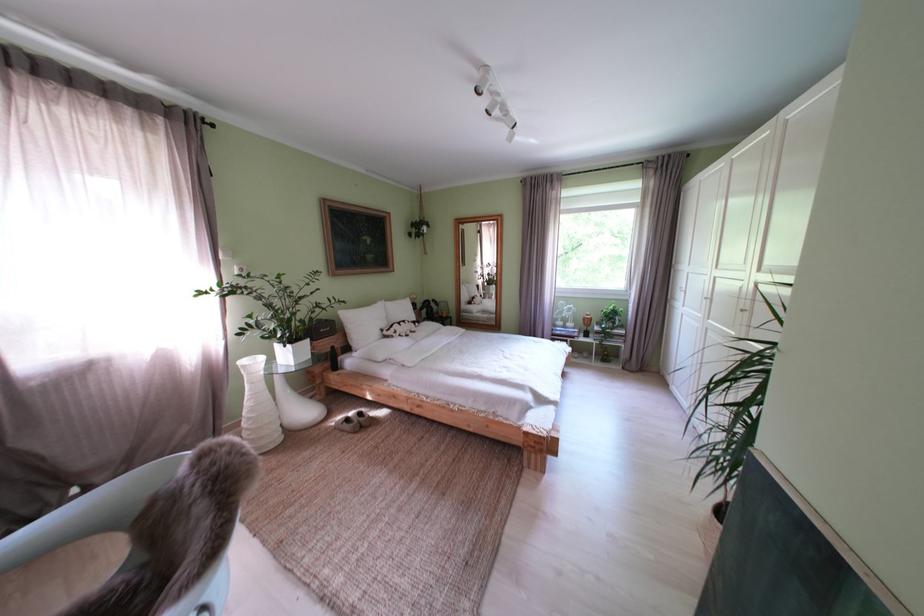
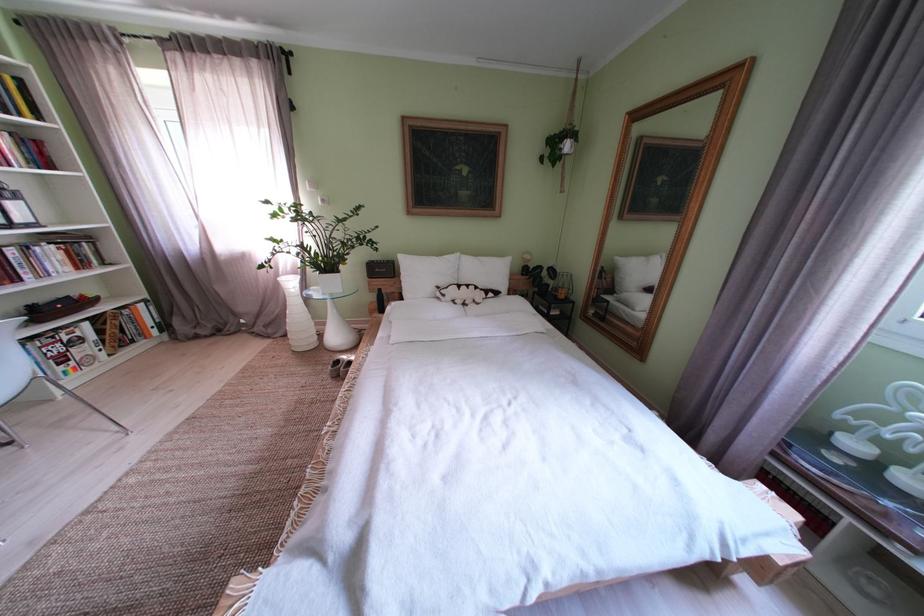
In the second image, find the point that corresponds to [407,338] in the first image.

(455, 301)